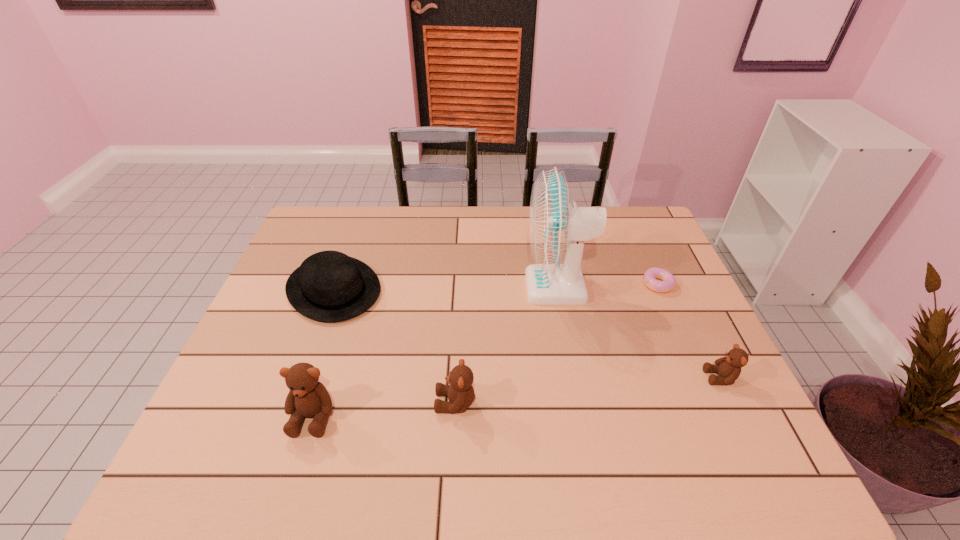
Point out which teddy bear is positioned as the second nearest to the rightmost teddy bear. Please provide its 2D coordinates. Your answer should be formatted as a tuple, i.e. [(x, y)], where the tuple contains the x and y coordinates of a point satisfying the conditions above.

[(307, 397)]

The height and width of the screenshot is (540, 960). Identify the location of teddy bear that is the second closest to the fedora. (460, 392).

Locate an element on the screen. free space that satisfies the following two spatial constraints: 1. on the face of the rightmost teddy bear; 2. on the face of the fifth shortest object is located at coordinates (739, 416).

Identify the location of vacant space that satisfies the following two spatial constraints: 1. in front of the fan to face the airflow; 2. on the face of the second tallest object. (582, 416).

The image size is (960, 540). Find the location of `vacant space that satisfies the following two spatial constraints: 1. on the back side of the fedora; 2. on the right side of the shortest object`. vacant space that satisfies the following two spatial constraints: 1. on the back side of the fedora; 2. on the right side of the shortest object is located at coordinates (335, 285).

Identify the location of vacant region that satisfies the following two spatial constraints: 1. on the face of the third tallest object; 2. on the face of the leftmost teddy bear. (455, 416).

Where is `blank space that satisfies the following two spatial constraints: 1. in front of the fan to face the airflow; 2. on the face of the tallest teddy bear`? The image size is (960, 540). blank space that satisfies the following two spatial constraints: 1. in front of the fan to face the airflow; 2. on the face of the tallest teddy bear is located at coordinates (x=582, y=416).

Identify the location of free spot that satisfies the following two spatial constraints: 1. on the face of the shortest teddy bear; 2. on the face of the tallest teddy bear. (739, 416).